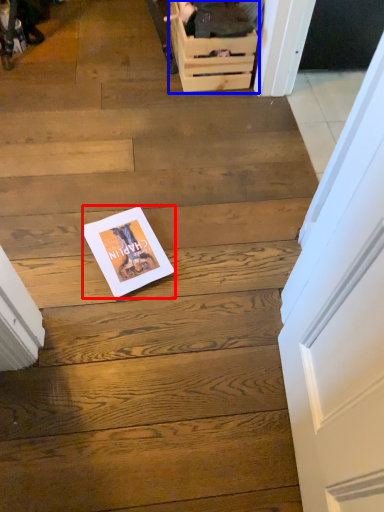
Question: Among these objects, which one is farthest to the camera, magazine (highlighted by a red box) or drawer (highlighted by a blue box)?

Choices:
 (A) magazine
 (B) drawer

Answer: (B)